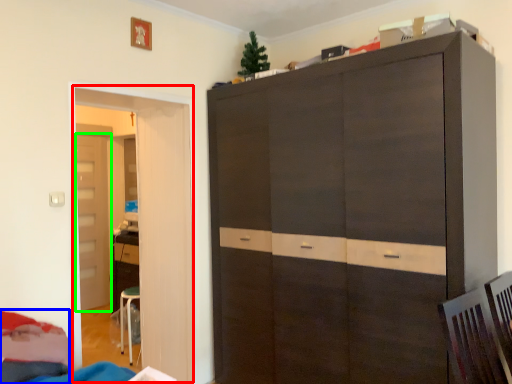
Question: Which is farther away from door (highlighted by a red box)? bed (highlighted by a blue box) or door (highlighted by a green box)?

Choices:
 (A) bed
 (B) door

Answer: (B)